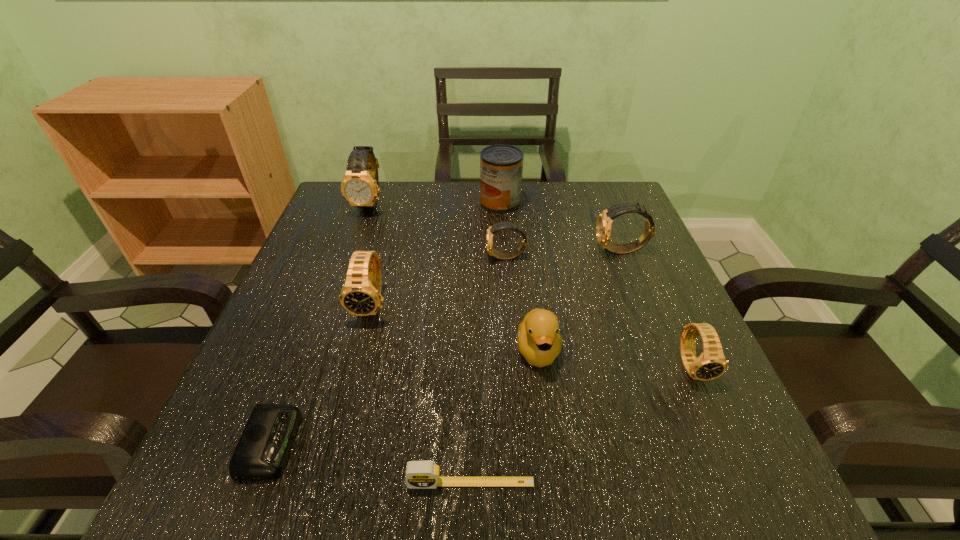
Where is `the right black watch`? The width and height of the screenshot is (960, 540). the right black watch is located at coordinates (711, 364).

This screenshot has width=960, height=540. Find the location of `tape measure`. tape measure is located at coordinates (419, 474).

At what (x,y) coordinates should I click in order to perform the action: click on alarm clock. Please return your answer as a coordinate pair (x, y). Image resolution: width=960 pixels, height=540 pixels. Looking at the image, I should click on (x=263, y=449).

Locate an element on the screen. Image resolution: width=960 pixels, height=540 pixels. vacant space located on the face of the tallest watch is located at coordinates (349, 263).

In order to click on vacant space positioned on the left of the can in this screenshot , I will do pos(405,203).

Where is `vacant area situated on the face of the rightmost gold watch`? This screenshot has height=540, width=960. vacant area situated on the face of the rightmost gold watch is located at coordinates (569, 251).

I want to click on vacant space located 0.120m on the face of the rightmost gold watch, so click(543, 251).

Locate an element on the screen. free space located 0.110m on the face of the rightmost gold watch is located at coordinates (547, 251).

Find the location of a particular element. The height and width of the screenshot is (540, 960). blank space located 0.110m on the face of the bigger black watch is located at coordinates (354, 374).

I want to click on vacant space located 0.070m facing forward on the duckling, so click(546, 414).